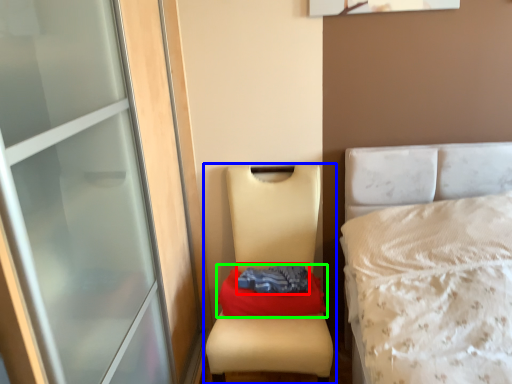
Question: Which is farther away from clothing (highlighted by a red box)? furniture (highlighted by a blue box) or material (highlighted by a green box)?

Choices:
 (A) furniture
 (B) material

Answer: (A)